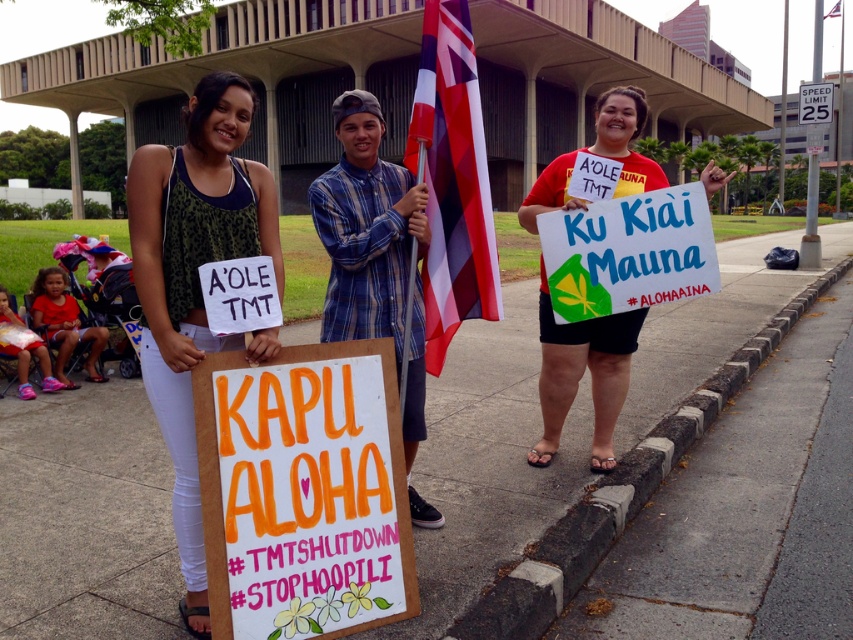
You are standing at the bottom of the image and want to walk towards the white concrete pavement at lower center. Which direction should you move to reach it?

Since the white concrete pavement at lower center is located at point (85, 516), you should move towards the right and slightly upward from your current position at the bottom of the image to reach it.